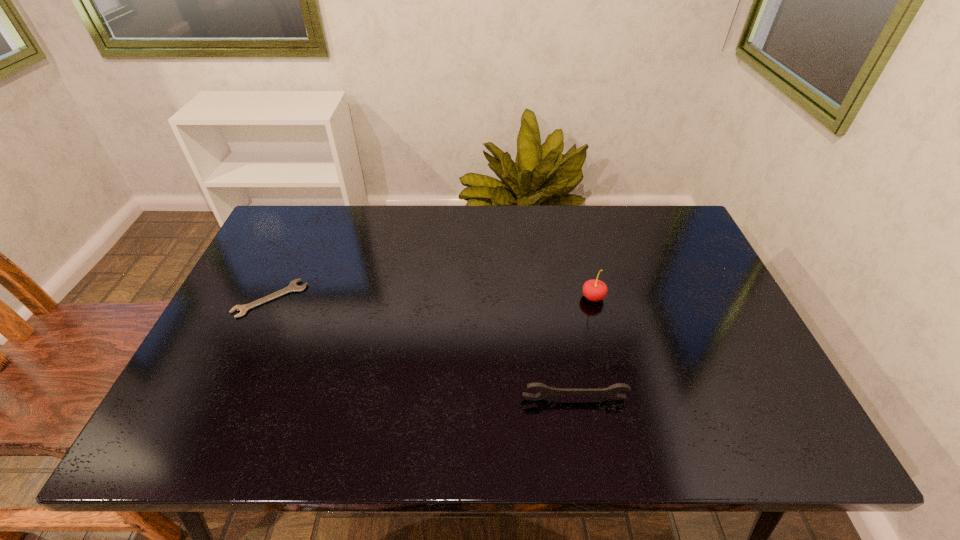
The width and height of the screenshot is (960, 540). In the image, there is a desktop. Identify the location of vacant space at the left edge. (243, 345).

The height and width of the screenshot is (540, 960). I want to click on free point at the right edge, so click(687, 260).

The height and width of the screenshot is (540, 960). I want to click on vacant area between the farther wrench and the tallest object, so click(x=432, y=298).

I want to click on empty space that is in between the cherry and the nearest object, so click(x=584, y=348).

This screenshot has width=960, height=540. In order to click on vacant area that lies between the shorter wrench and the cherry in this screenshot , I will do `click(432, 298)`.

Where is `free spot between the shorter wrench and the cherry`? The image size is (960, 540). free spot between the shorter wrench and the cherry is located at coordinates (432, 298).

Image resolution: width=960 pixels, height=540 pixels. In order to click on free spot between the farther wrench and the cherry in this screenshot , I will do `click(432, 298)`.

This screenshot has width=960, height=540. I want to click on blank region between the nearest object and the leftmost object, so click(422, 349).

Locate an element on the screen. This screenshot has height=540, width=960. vacant area that lies between the farther wrench and the cherry is located at coordinates (432, 298).

Where is `free point between the left wrench and the cherry`? The height and width of the screenshot is (540, 960). free point between the left wrench and the cherry is located at coordinates (432, 298).